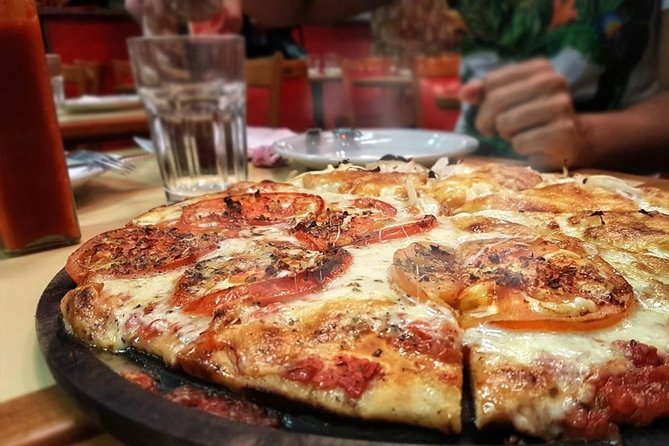
Image resolution: width=669 pixels, height=446 pixels. Identify the location of plate. (409, 147).